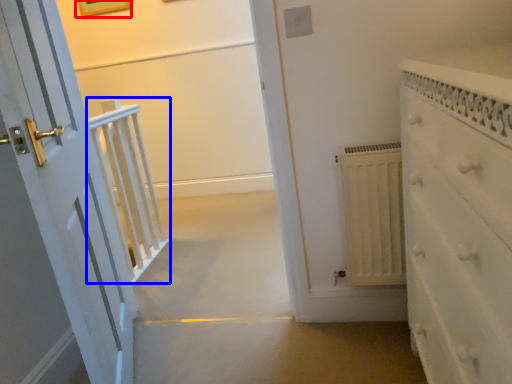
Question: Which of the following is the farthest to the observer, picture frame (highlighted by a red box) or balustrade (highlighted by a blue box)?

Choices:
 (A) picture frame
 (B) balustrade

Answer: (A)